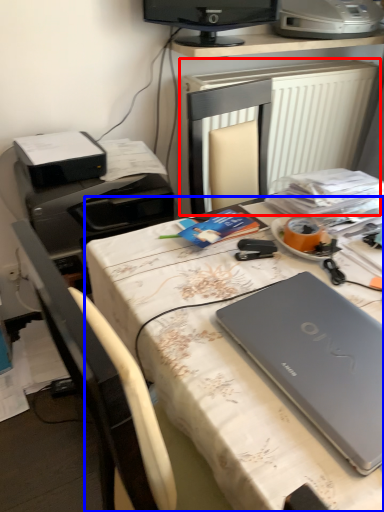
Question: Among these objects, which one is nearest to the camera, radiator (highlighted by a red box) or desk (highlighted by a blue box)?

Choices:
 (A) radiator
 (B) desk

Answer: (B)